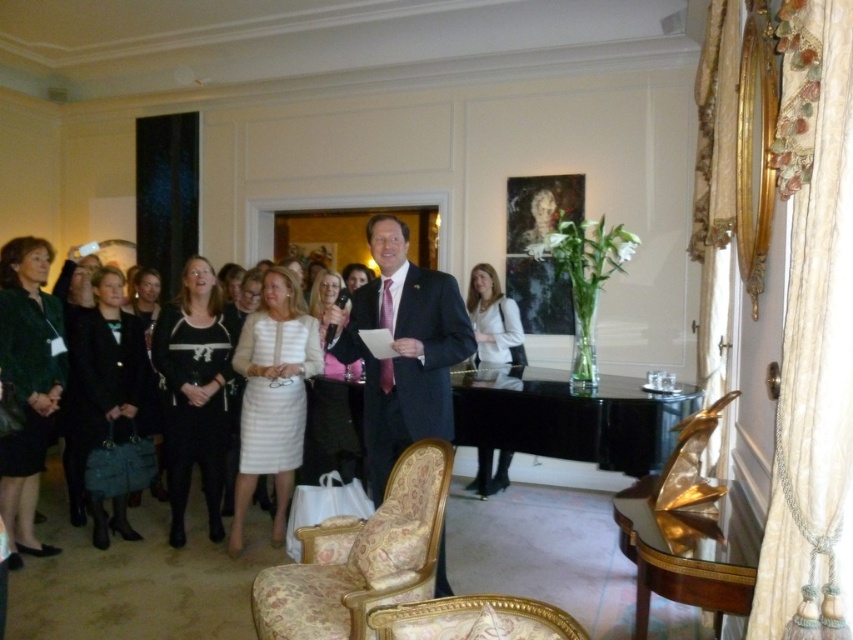
You are a photographer at a formal event and need to position two subjects, the matte black suit at center and the white textured dress at center, so that their heights are visually balanced in the photo. Which subject should you place closer to the camera to achieve this balance?

The matte black suit at center is taller than the white textured dress at center. To balance their heights in the photo, place the white textured dress at center closer to the camera since it is shorter, making it appear taller in the frame.